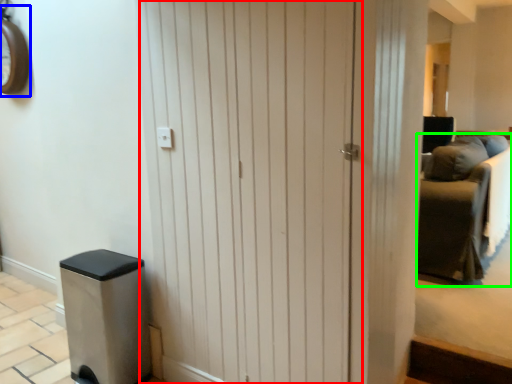
Question: Which object is positioned farthest from barn door (highlighted by a red box)? Select from clock (highlighted by a blue box) and furniture (highlighted by a green box).

Choices:
 (A) clock
 (B) furniture

Answer: (A)